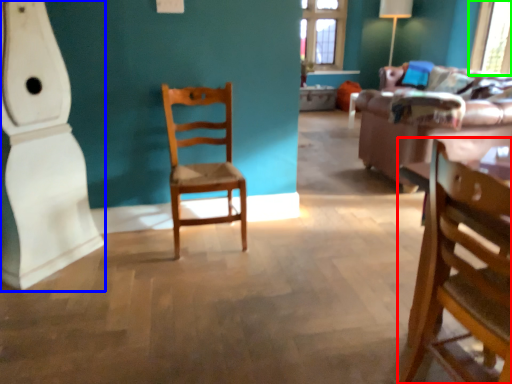
Question: Which is nearer to the chair (highlighted by a red box)? wide (highlighted by a blue box) or window screen (highlighted by a green box).

Choices:
 (A) wide
 (B) window screen

Answer: (A)